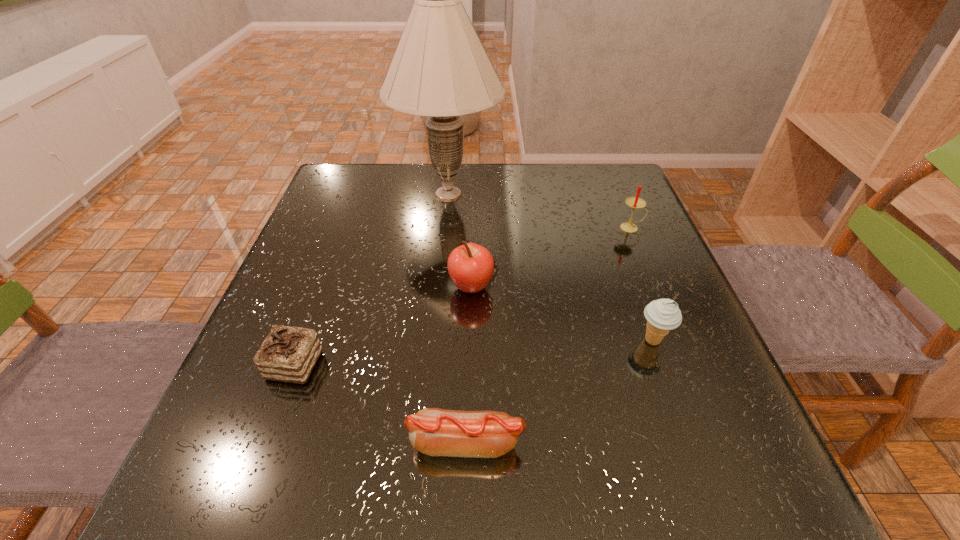
Locate an element on the screen. This screenshot has height=540, width=960. free point located on the back of the leftmost object is located at coordinates (309, 325).

At what (x,y) coordinates should I click in order to perform the action: click on vacant space located 0.070m on the back of the nearest object. Please return your answer as a coordinate pair (x, y). Looking at the image, I should click on (468, 385).

Locate an element on the screen. The width and height of the screenshot is (960, 540). object at the far edge is located at coordinates (440, 69).

The height and width of the screenshot is (540, 960). Find the location of `object that is at the near edge`. object that is at the near edge is located at coordinates (435, 432).

Identify the location of object that is at the left edge. (288, 354).

Image resolution: width=960 pixels, height=540 pixels. Find the location of `candle that is at the right edge`. candle that is at the right edge is located at coordinates (634, 202).

The height and width of the screenshot is (540, 960). Find the location of `icecream present at the right edge`. icecream present at the right edge is located at coordinates (662, 315).

Identify the location of blank space at the far edge of the desktop. The width and height of the screenshot is (960, 540). (564, 188).

Locate an element on the screen. free space at the near edge of the desktop is located at coordinates (372, 485).

In the image, there is a desktop. At what (x,y) coordinates should I click in order to perform the action: click on vacant area at the left edge. Please return your answer as a coordinate pair (x, y). Looking at the image, I should click on (247, 414).